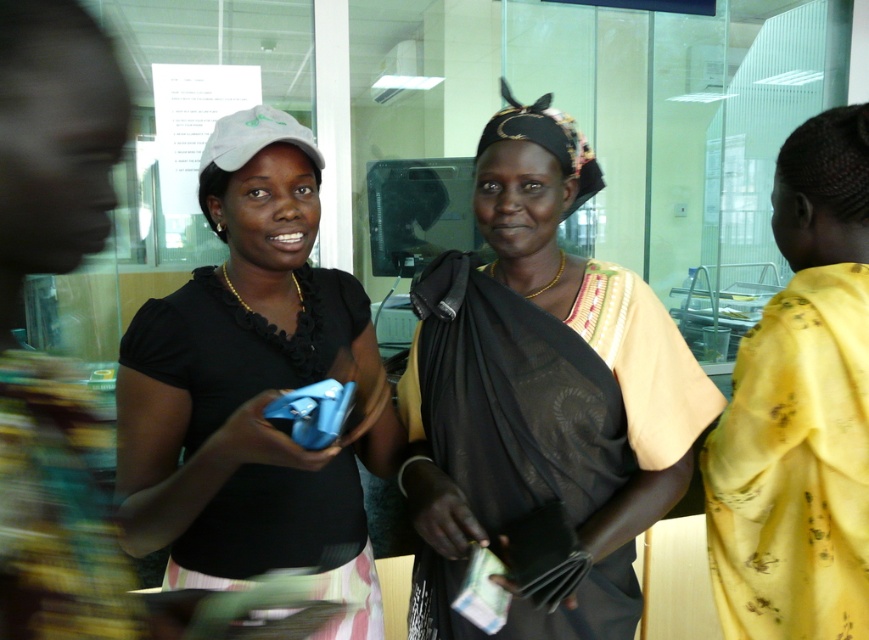
Question: Can you confirm if black textured scarf at center is thinner than matte black shirt at center?

Choices:
 (A) yes
 (B) no

Answer: (B)

Question: Which point appears closest to the camera in this image?

Choices:
 (A) (131, 372)
 (B) (542, 161)

Answer: (A)

Question: Does black textured scarf at center have a lesser width compared to matte black shirt at center?

Choices:
 (A) yes
 (B) no

Answer: (B)

Question: Is black textured scarf at center below matte black shirt at center?

Choices:
 (A) yes
 (B) no

Answer: (B)

Question: Which point is farther from the camera taking this photo?

Choices:
 (A) (542, 403)
 (B) (346, 566)

Answer: (B)